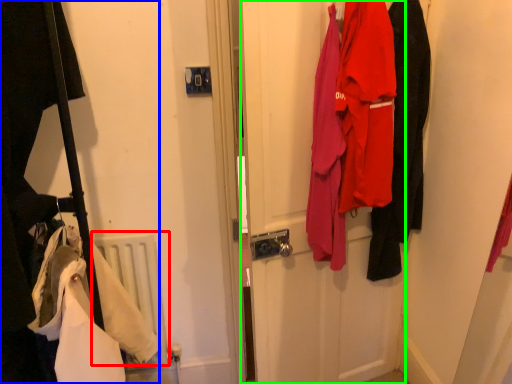
Question: Based on their relative distances, which object is nearer to radiator (highlighted by a red box)? Choose from closet (highlighted by a blue box) and door (highlighted by a green box).

Choices:
 (A) closet
 (B) door

Answer: (A)